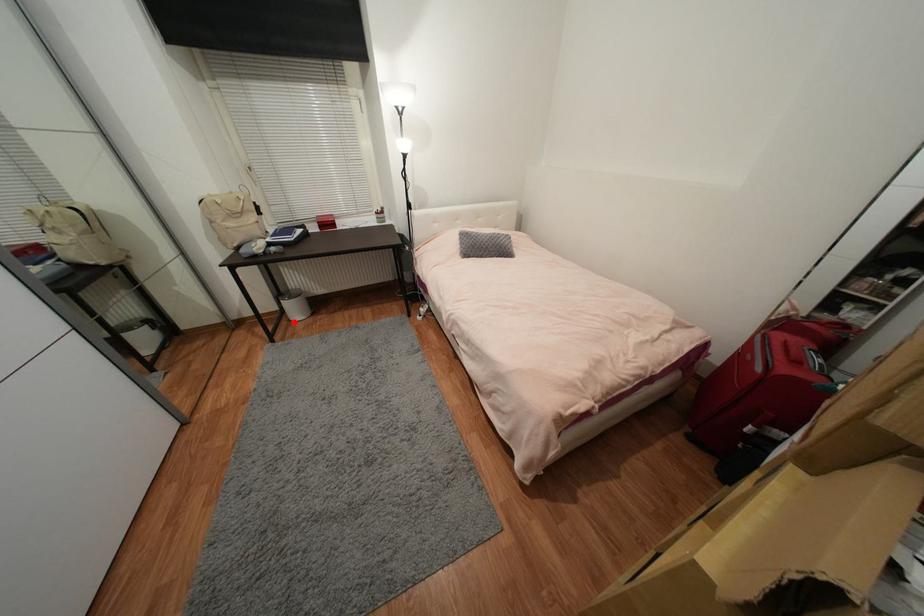
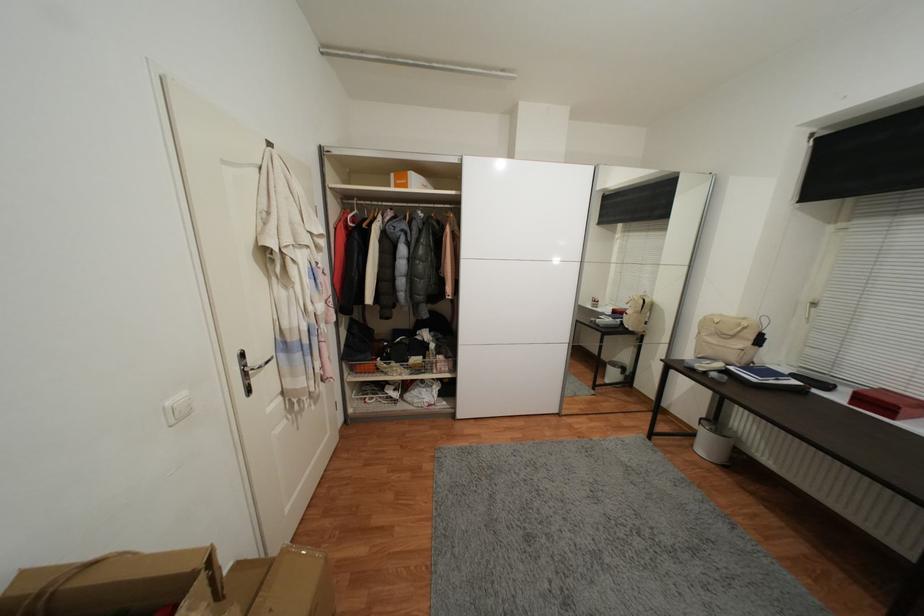
Question: I am providing you with two images of the same scene from different viewpoints. Image1 has a red point marked. In image2, the corresponding 3D location appears at what relative position? Reply with the corresponding letter.

Choices:
 (A) Closer
 (B) Farther

Answer: (B)